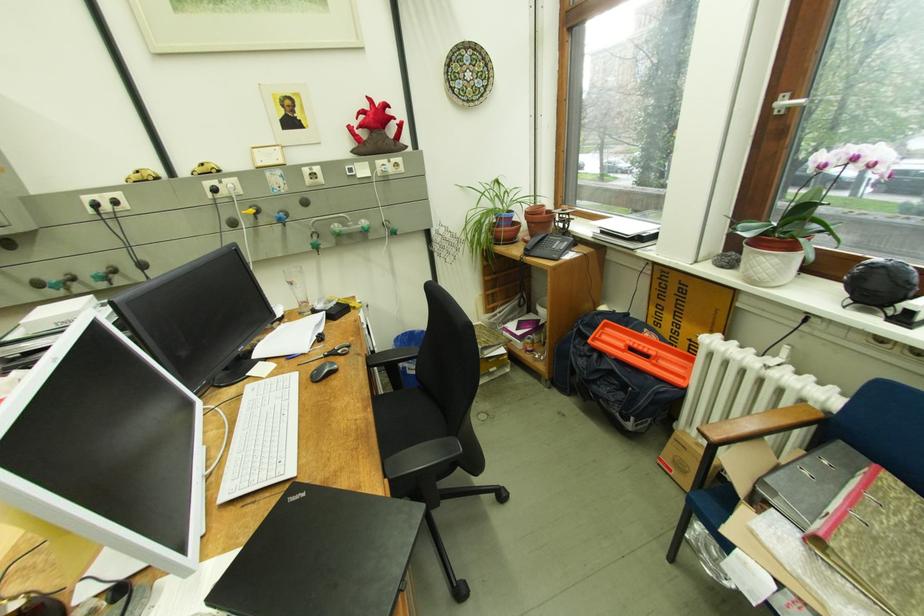
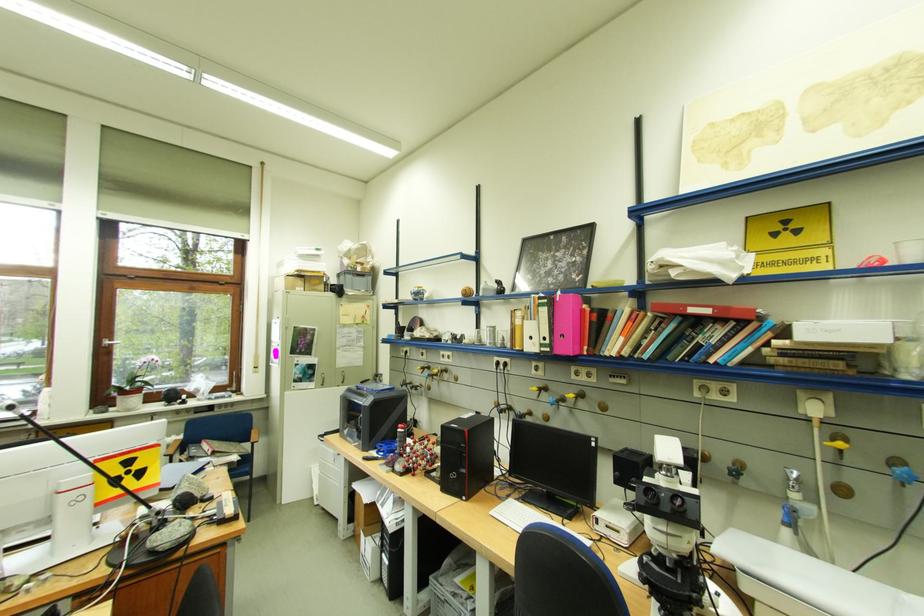
Where in the second image is the point corresponding to (x=794, y=103) from the first image?

(117, 342)